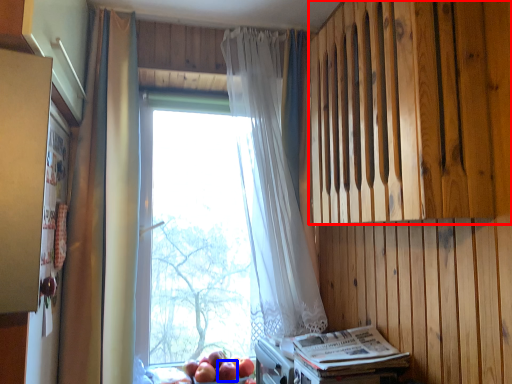
Question: Which object appears farthest to the camera in this image, wood (highlighted by a red box) or apple (highlighted by a blue box)?

Choices:
 (A) wood
 (B) apple

Answer: (B)